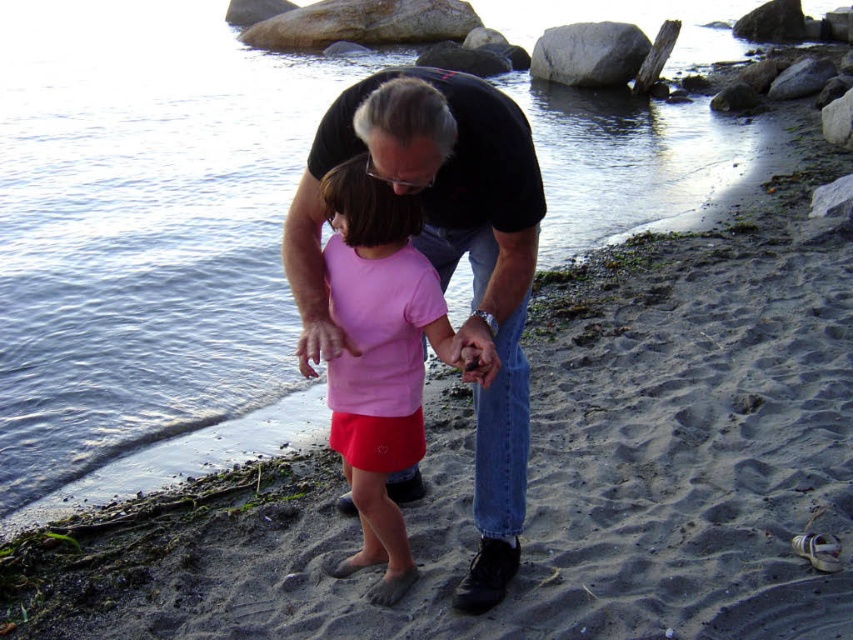
You are a photographer trying to capture the pink matte shirt at center in your shot. Based on the scene description, where should you position your camera relative to the shirt to ensure it is centered in the frame?

The pink matte shirt at center is already positioned at the center of the image, so you should position your camera directly facing the shirt to keep it centered in the frame.

You are a photographer trying to capture the scene with the pink matte shirt at center and the smooth gray rock at upper center. Based on their positions, which object should you focus on first if you want to ensure both are in sharp focus?

The pink matte shirt at center has a greater height compared to the smooth gray rock at upper center, so focusing on the pink matte shirt at center first will help ensure both are in sharp focus since it is closer to the camera.